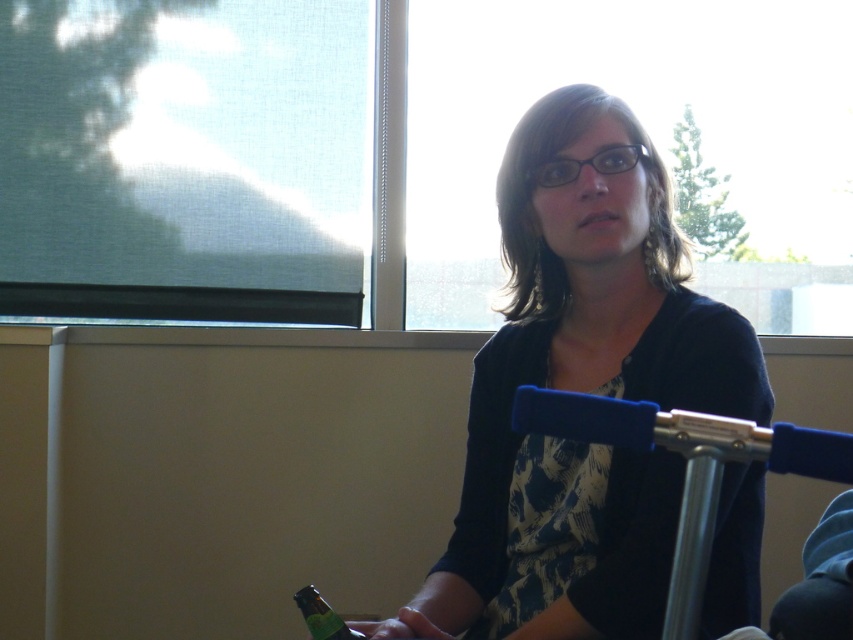
Question: Which point is closer to the camera taking this photo?

Choices:
 (A) click(297, 604)
 (B) click(662, 230)

Answer: (A)

Question: Which object appears farthest from the camera in this image?

Choices:
 (A) green matte bottle at lower left
 (B) matte black sweater at center

Answer: (A)

Question: Can you confirm if matte black sweater at center is bigger than green matte bottle at lower left?

Choices:
 (A) yes
 (B) no

Answer: (A)

Question: Is matte black sweater at center smaller than green matte bottle at lower left?

Choices:
 (A) yes
 (B) no

Answer: (B)

Question: Does matte black sweater at center come in front of green matte bottle at lower left?

Choices:
 (A) no
 (B) yes

Answer: (B)

Question: Which point is closer to the camera?

Choices:
 (A) (328, 605)
 (B) (618, 116)

Answer: (A)